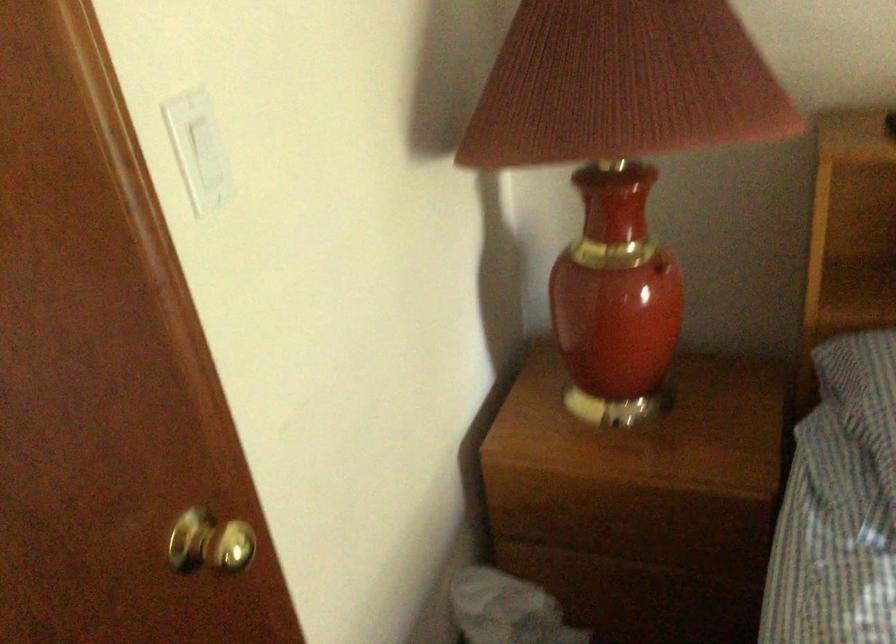
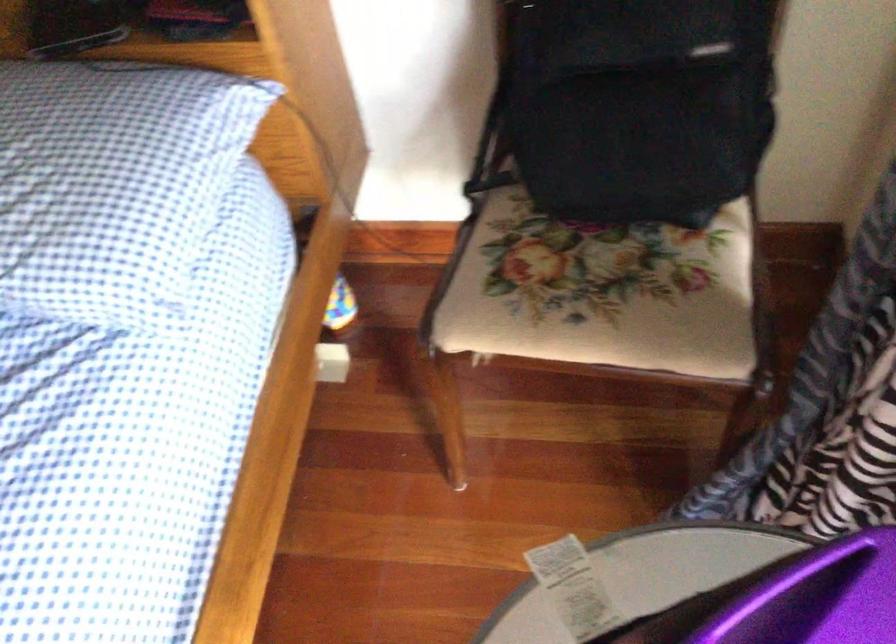
Question: In a continuous first-person perspective shot, in which direction is the camera moving?

Choices:
 (A) Left
 (B) Right
 (C) Forward
 (D) Backward

Answer: (B)